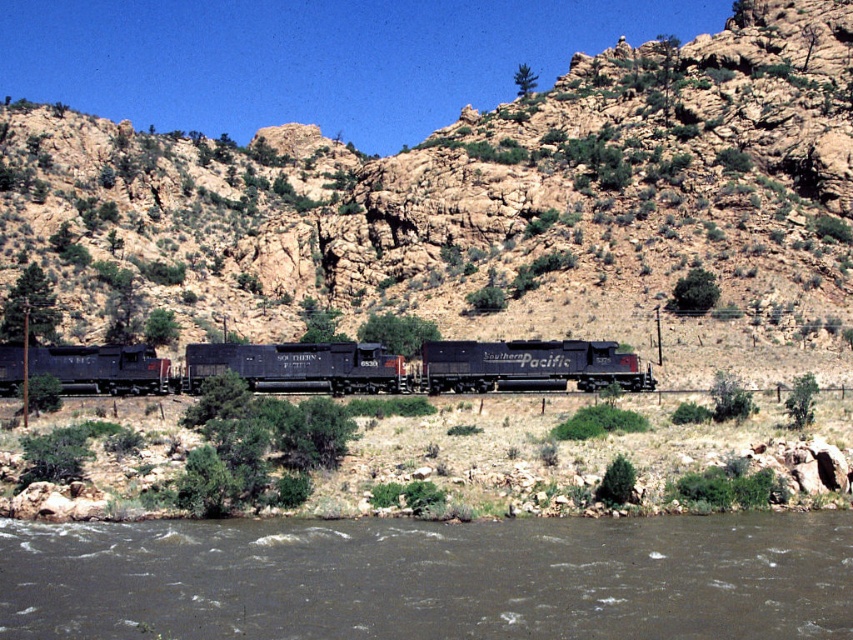
You are a hiker planning to cross the river using a narrow path along the riverbank. The path is near the point marked at coordinates (431,579). What is the condition of the ground at that specific point?

The ground at point (431,579) is covered with brown muddy water at lower center, which suggests it might be slippery and unstable, making it difficult to cross safely.

You are a hiker planning to cross the river using the train tracks. The train tracks are represented by two points, point A at point (544, 564) and point B at point (770, 445). Which point should you cross first to follow the direction of the train tracks?

You should cross point A at point (544, 564) first because it is in front of point B at point (770, 445), indicating the direction of the train tracks.

You are a hiker standing at the point marked as point (753, 460). You want to cross the river to reach the other side where point (102, 381) is located. Based on the terrain, which direction should you move to find the shallowest part of the river?

You should move towards point (102, 381) because it is farther from the camera, which likely corresponds to a shallower area in the river where the water flows less intensely.